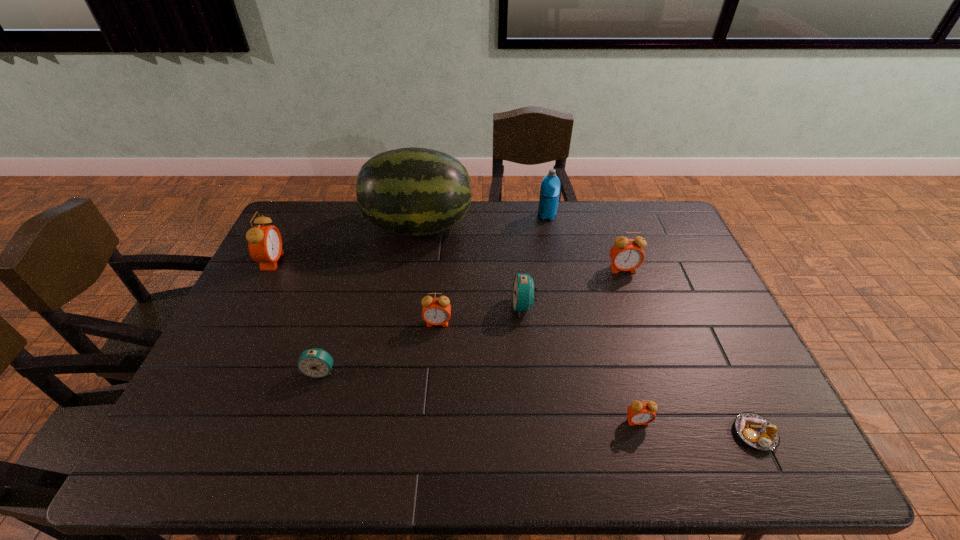
Locate an element on the screen. This screenshot has height=540, width=960. free spot between the pastry and the nearest pink alarm clock is located at coordinates (696, 427).

Identify the location of free space between the bigger blue alarm clock and the fifth shortest alarm clock. (573, 288).

Where is `free space that is in between the rightmost object and the biggest pink alarm clock`? free space that is in between the rightmost object and the biggest pink alarm clock is located at coordinates (514, 347).

You are a GUI agent. You are given a task and a screenshot of the screen. Output one action in this format:
    pyautogui.click(x=<x>, y=<y>)
    Task: Click on the free point between the second nearest pink alarm clock and the tallest alarm clock
    This screenshot has height=540, width=960.
    Given the screenshot: What is the action you would take?
    pyautogui.click(x=355, y=292)

What are the coordinates of `free area in between the seventh farthest object and the leftmost alarm clock` in the screenshot? It's located at (297, 316).

In order to click on vacant area that lies between the third alarm clock from left to right and the nearer blue alarm clock in this screenshot , I will do `click(379, 347)`.

At what (x,y) coordinates should I click in order to perform the action: click on the eighth closest object to the nearest pink alarm clock. Please return your answer as a coordinate pair (x, y). The height and width of the screenshot is (540, 960). Looking at the image, I should click on (265, 243).

Identify which object is the seventh nearest to the smaller blue alarm clock. Please provide its 2D coordinates. Your answer should be formatted as a tuple, i.e. [(x, y)], where the tuple contains the x and y coordinates of a point satisfying the conditions above.

[(626, 254)]

Locate which alarm clock is the second closest to the thermos bottle. Please provide its 2D coordinates. Your answer should be formatted as a tuple, i.e. [(x, y)], where the tuple contains the x and y coordinates of a point satisfying the conditions above.

[(523, 293)]

The height and width of the screenshot is (540, 960). Identify the location of the second closest alarm clock to the third smallest pink alarm clock. (640, 413).